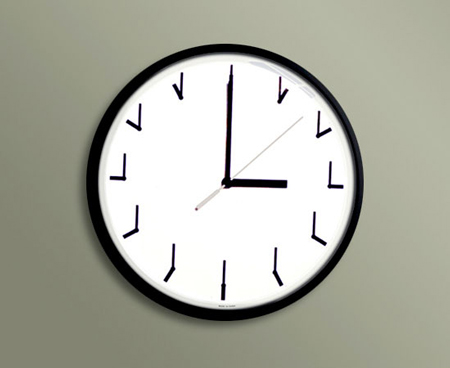
Find the location of a particular element. The width and height of the screenshot is (450, 368). empty space to right of clock is located at coordinates (408, 187).